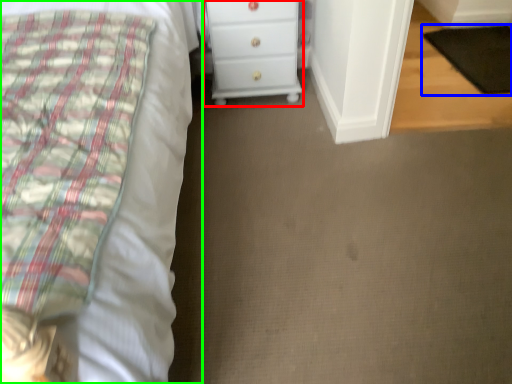
Question: Which object is the farthest from chest of drawers (highlighted by a red box)? Choose among these: pad (highlighted by a blue box) or bed (highlighted by a green box).

Choices:
 (A) pad
 (B) bed

Answer: (A)